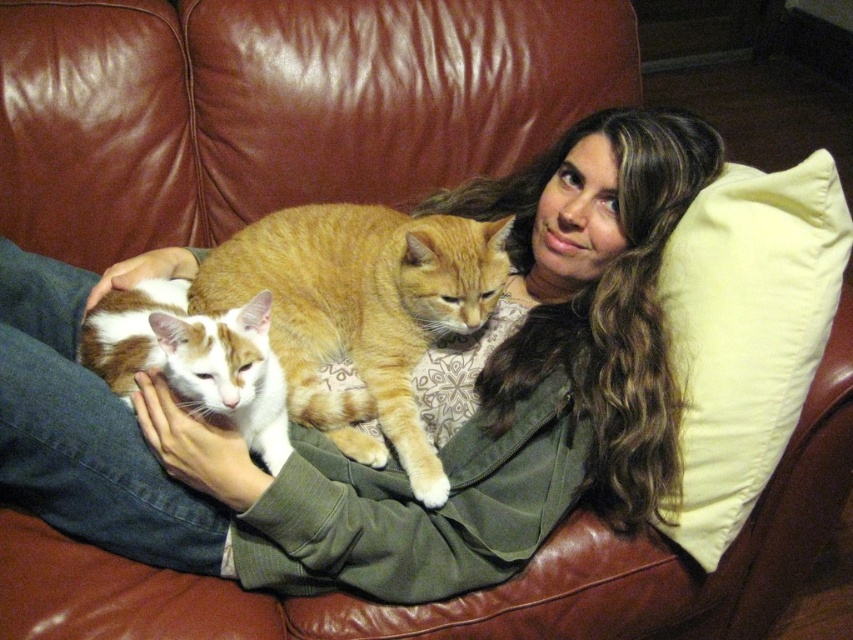
You are a photographer setting up for a portrait. You need to ensure the orange tabby cat at center is visible above the white fabric pillow at right. Based on the scene description, will the cat be visible above the pillow?

The white fabric pillow at right is below the orange tabby cat at center, so yes, the orange tabby cat at center will be visible above the white fabric pillow at right.

You are a photographer trying to capture the orange tabby cat at center and the white and orange fur cat at center in a clear photo. Which cat should you focus on first to ensure both are in focus?

The orange tabby cat at center is positioned over the white and orange fur cat at center, so you should focus on the orange tabby cat at center first to ensure both are in focus.

You are an interior designer planning to place a new lamp on the right side of the couch. The lamp has a base that occupies a circular area with a radius of 0.1 units. Given the coordinates of the white fabric pillow at right, can you determine if there is enough space to place the lamp without overlapping the pillow?

The white fabric pillow at right is located at coordinates point (747, 332). To determine if the lamp can be placed without overlapping, we need to ensure the distance between the lamp base center and the pillow is at least 0.1 units. However, without knowing the lamp placement coordinates or pillow dimensions, an exact calculation isn